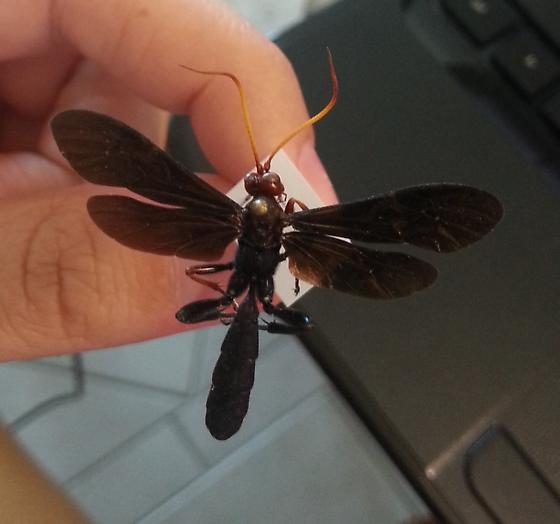
Locate an element on the screen. laptop key is located at coordinates (484, 21), (530, 71), (540, 12), (550, 104).